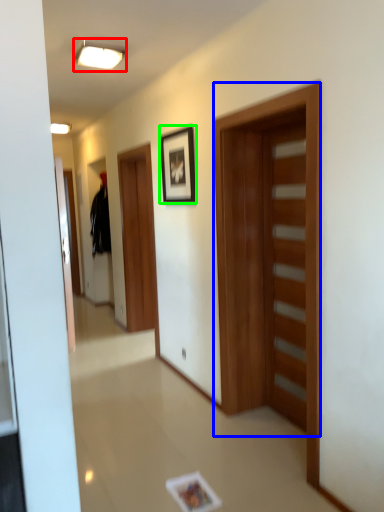
Question: Estimate the real-world distances between objects in this image. Which object is closer to light fixture (highlighted by a red box), door (highlighted by a blue box) or picture frame (highlighted by a green box)?

Choices:
 (A) door
 (B) picture frame

Answer: (B)